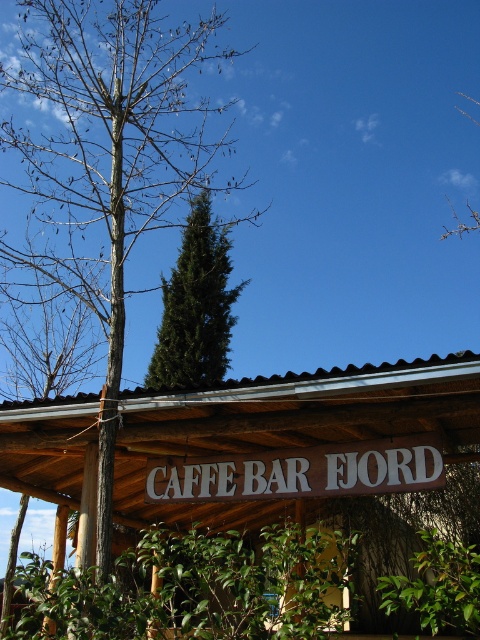
Based on the photo, you are a visitor at the Caffe Bar Fjord and want to take a photo of the white wood sign at center and the green coniferous tree at upper center. Based on their positions, which object should you frame first in your camera viewfinder to ensure both are in the shot?

The green coniferous tree at upper center should be framed first since the white wood sign at center is to the right of it, meaning the tree is positioned to the left of the sign. By starting with the tree, you can adjust the viewfinder to include both objects to the right.

You are a visitor standing in front of the rustic wooden structure. You notice a white wood sign at center and a green coniferous tree at upper center. Which object is positioned higher in the image?

The green coniferous tree at upper center is positioned higher than the white wood sign at center.